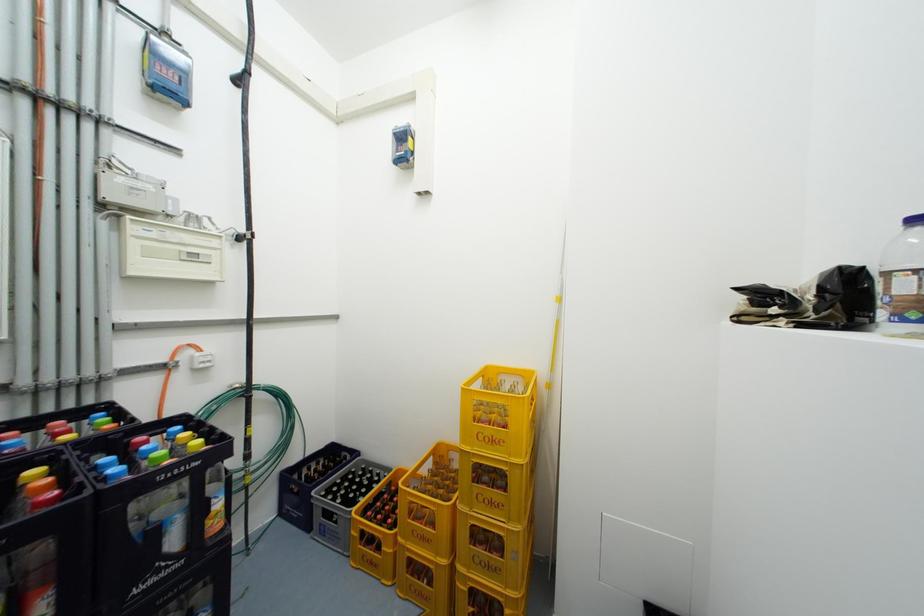
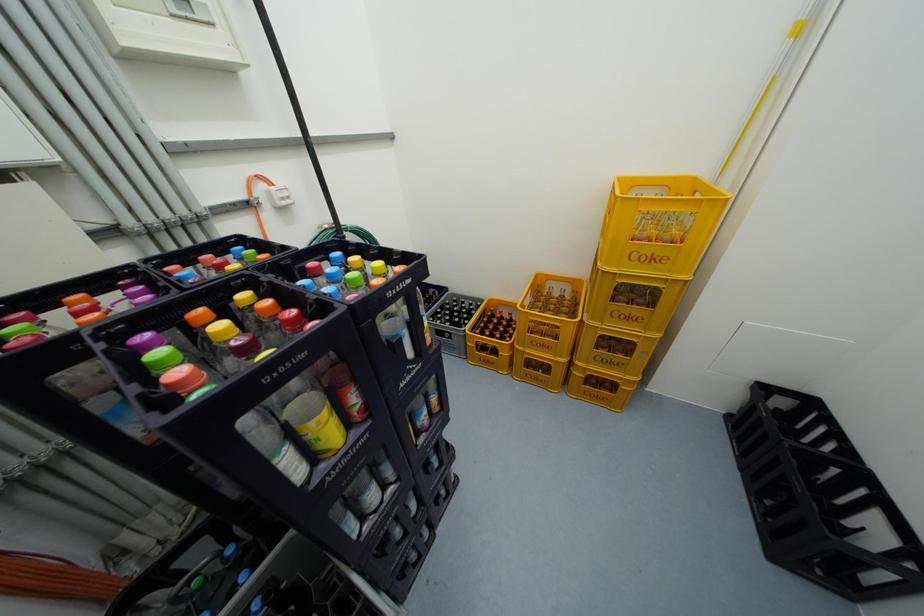
Question: The first image is from the beginning of the video and the second image is from the end. How did the camera likely rotate when shooting the video?

Choices:
 (A) Left
 (B) Right
 (C) Up
 (D) Down

Answer: (D)